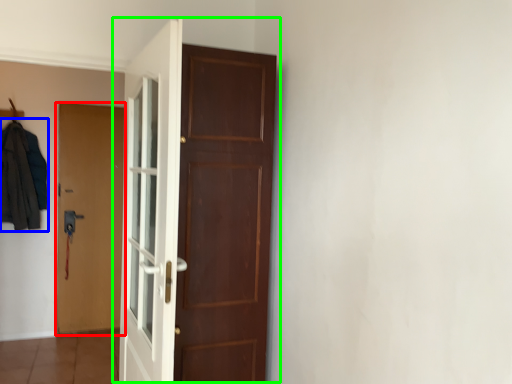
Question: Based on their relative distances, which object is farther from door (highlighted by a red box)? Choose from clothing (highlighted by a blue box) and door (highlighted by a green box).

Choices:
 (A) clothing
 (B) door

Answer: (B)